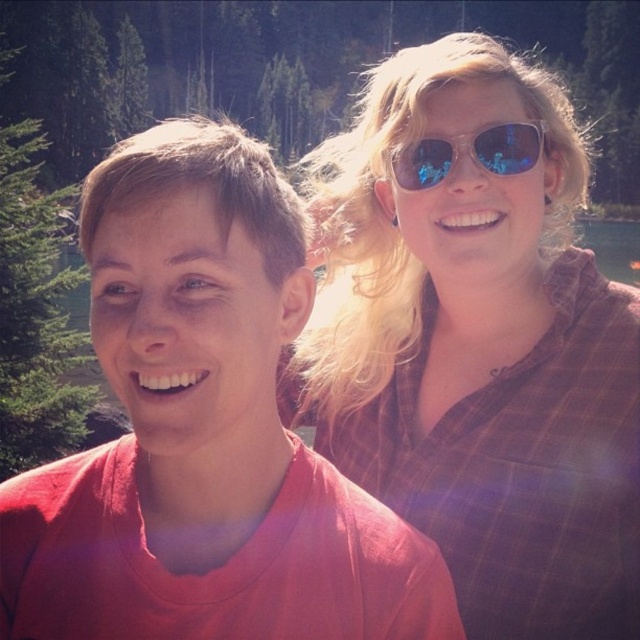
Question: Can you confirm if matte red t-shirt at center is wider than sunglasses at upper right?

Choices:
 (A) no
 (B) yes

Answer: (B)

Question: Which object appears farthest from the camera in this image?

Choices:
 (A) plaid shirt at upper right
 (B) matte red t-shirt at center
 (C) sunglasses at upper right

Answer: (A)

Question: Which point appears farthest from the camera in this image?

Choices:
 (A) (452, 150)
 (B) (33, 528)
 (C) (394, 179)

Answer: (C)

Question: Estimate the real-world distances between objects in this image. Which object is farther from the matte red t-shirt at center?

Choices:
 (A) plaid shirt at upper right
 (B) sunglasses at upper right

Answer: (A)

Question: Can you confirm if plaid shirt at upper right is positioned below sunglasses at upper right?

Choices:
 (A) yes
 (B) no

Answer: (B)

Question: Is the position of matte red t-shirt at center more distant than that of sunglasses at upper right?

Choices:
 (A) yes
 (B) no

Answer: (B)